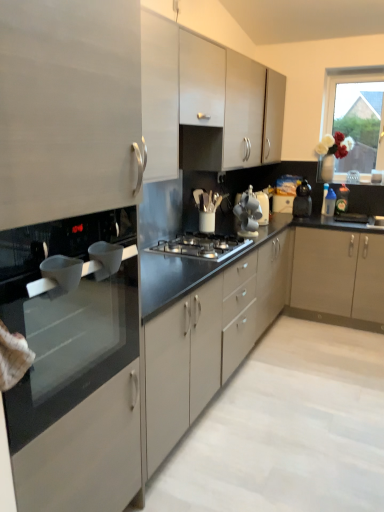
Locate an element on the screen. This screenshot has height=512, width=384. vacant space situated above white glass vase at upper right (from a real-world perspective) is located at coordinates (355, 74).